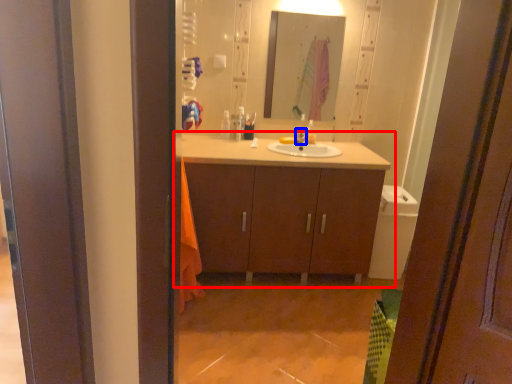
Question: Among these objects, which one is nearest to the camera, bathroom cabinet (highlighted by a red box) or tap (highlighted by a blue box)?

Choices:
 (A) bathroom cabinet
 (B) tap

Answer: (A)